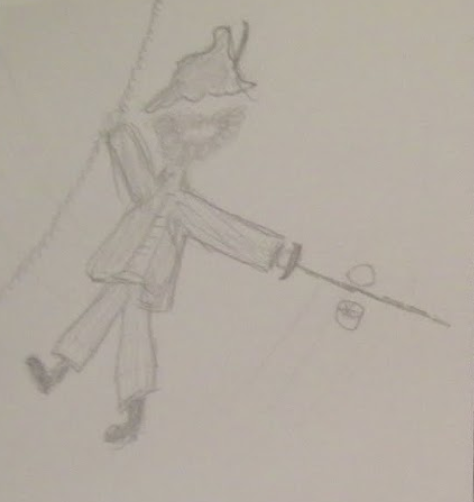
Identify the location of beige/tan background. Image resolution: width=474 pixels, height=502 pixels. (414, 188).